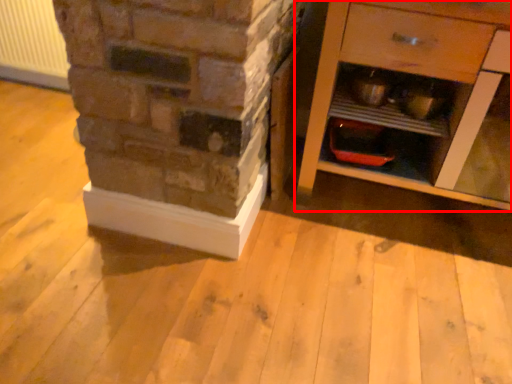
Question: From the image's perspective, what is the correct spatial positioning of chest of drawers (annotated by the red box) in reference to radiator?

Choices:
 (A) below
 (B) above

Answer: (A)